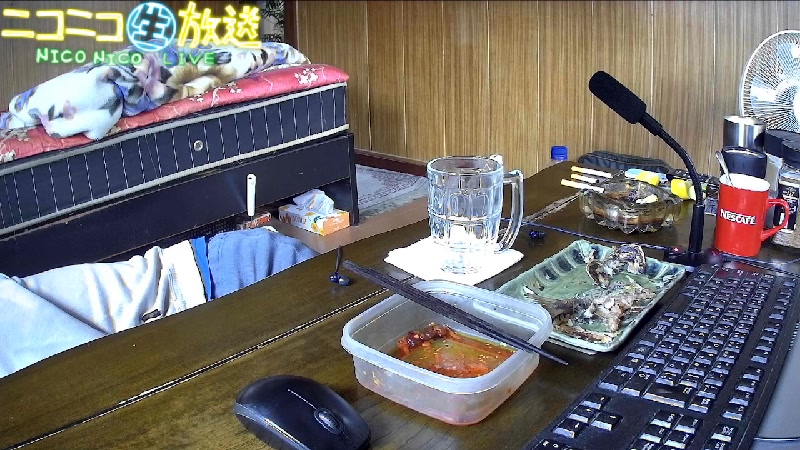
Image resolution: width=800 pixels, height=450 pixels. I want to click on ash tray, so click(622, 193).